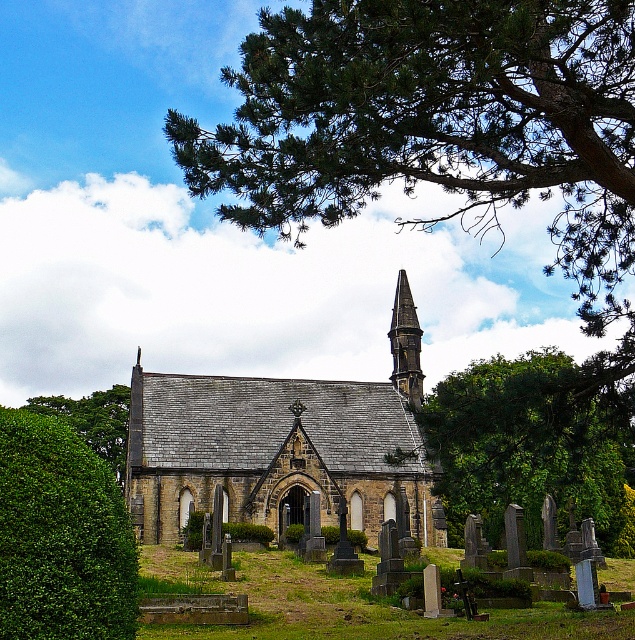
Is stone gray church at center to the left of green leafy bush at lower left from the viewer's perspective?

No, stone gray church at center is not to the left of green leafy bush at lower left.

Can you confirm if stone gray church at center is positioned below green leafy bush at lower left?

Incorrect, stone gray church at center is not positioned below green leafy bush at lower left.

Which is behind, point (190, 444) or point (114, 458)?

Positioned behind is point (114, 458).

Identify the location of stone gray church at center. (283, 444).

Who is more forward, (361, 58) or (124, 387)?

Point (361, 58)

Who is more distant from viewer, (469, 96) or (83, 428)?

Point (83, 428)

The width and height of the screenshot is (635, 640). Describe the element at coordinates (439, 129) in the screenshot. I see `green leafy tree at upper center` at that location.

You are a GUI agent. You are given a task and a screenshot of the screen. Output one action in this format:
    pyautogui.click(x=<x>, y=<y>)
    Task: Click on the green leafy tree at upper center
    The width and height of the screenshot is (635, 640).
    Given the screenshot: What is the action you would take?
    pyautogui.click(x=439, y=129)

Is point (542, 387) positioned behind point (123, 544)?

That is True.

Between point (450, 528) and point (8, 422), which one is positioned behind?

Positioned behind is point (450, 528).

This screenshot has height=640, width=635. Find the location of `green leafy tree at center`. green leafy tree at center is located at coordinates (530, 444).